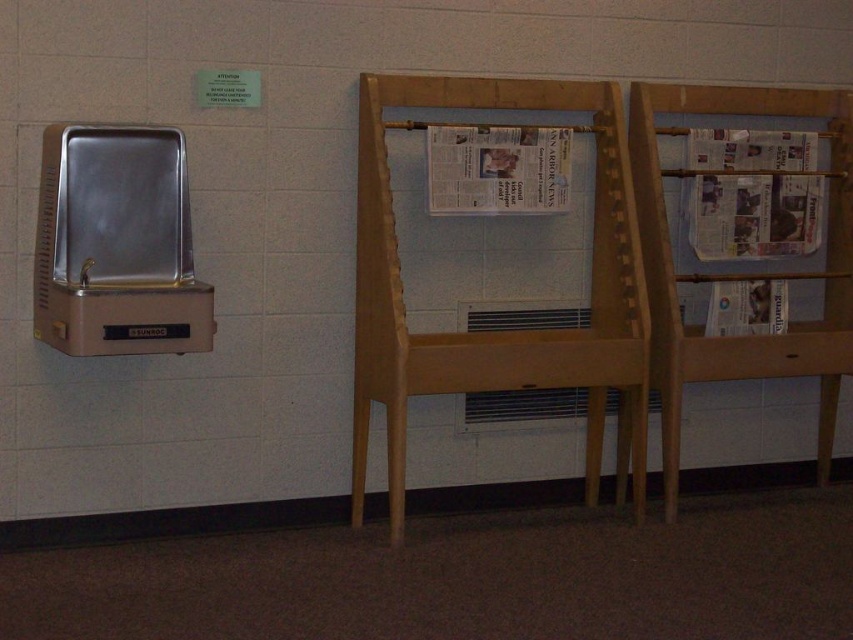
Question: Does light brown wooden newspaper rack at center have a larger size compared to white glossy newspaper at center?

Choices:
 (A) yes
 (B) no

Answer: (A)

Question: Which point appears closest to the camera in this image?

Choices:
 (A) (611, 196)
 (B) (532, 212)

Answer: (B)

Question: Is light brown wooden newspaper rack at center further to the viewer compared to white glossy newspaper at center?

Choices:
 (A) no
 (B) yes

Answer: (A)

Question: Does light brown wooden newspaper rack at center have a smaller size compared to white glossy newspaper at center?

Choices:
 (A) no
 (B) yes

Answer: (A)